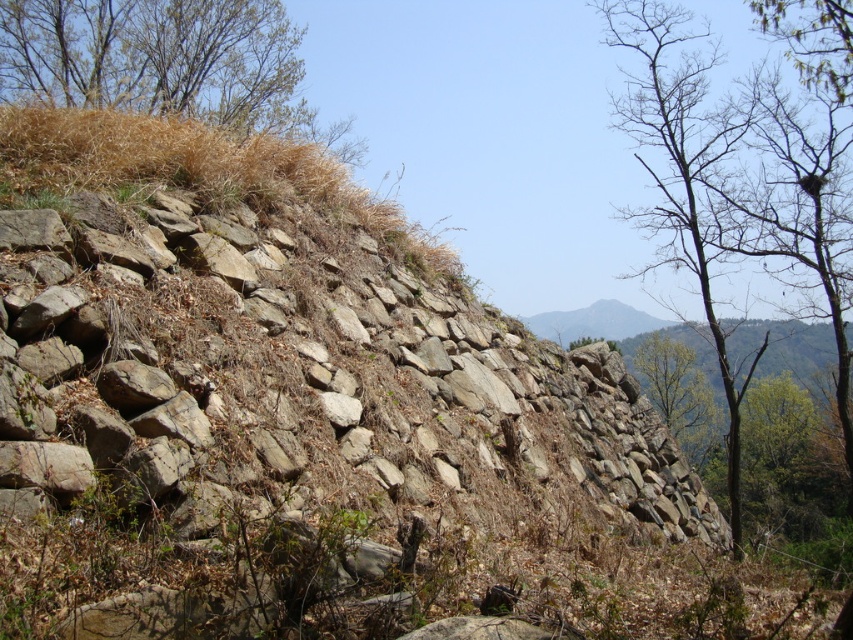
How far apart are brown grass at upper left and green leafy tree at upper right?

28.39 meters

Is the position of brown grass at upper left less distant than that of green leafy tree at upper right?

Yes, brown grass at upper left is in front of green leafy tree at upper right.

Describe the element at coordinates (166, 64) in the screenshot. I see `brown grass at upper left` at that location.

I want to click on brown grass at upper left, so click(x=166, y=64).

This screenshot has height=640, width=853. What do you see at coordinates (166, 64) in the screenshot? I see `brown grass at upper left` at bounding box center [166, 64].

Does point (245, 1) come closer to viewer compared to point (729, 440)?

No.

Does point (152, 97) come closer to viewer compared to point (685, 116)?

No, it is behind (685, 116).

You are a GUI agent. You are given a task and a screenshot of the screen. Output one action in this format:
    pyautogui.click(x=<x>, y=<y>)
    Task: Click on the brown grass at upper left
    
    Given the screenshot: What is the action you would take?
    pyautogui.click(x=166, y=64)

Can you confirm if bare branches at upper right is shorter than green leafy tree at upper right?

No, bare branches at upper right is not shorter than green leafy tree at upper right.

Can you confirm if bare branches at upper right is bigger than green leafy tree at upper right?

Correct, bare branches at upper right is larger in size than green leafy tree at upper right.

Who is more forward, (683, 92) or (639, 380)?

Point (683, 92) is in front.

Locate an element on the screen. This screenshot has height=640, width=853. bare branches at upper right is located at coordinates (680, 170).